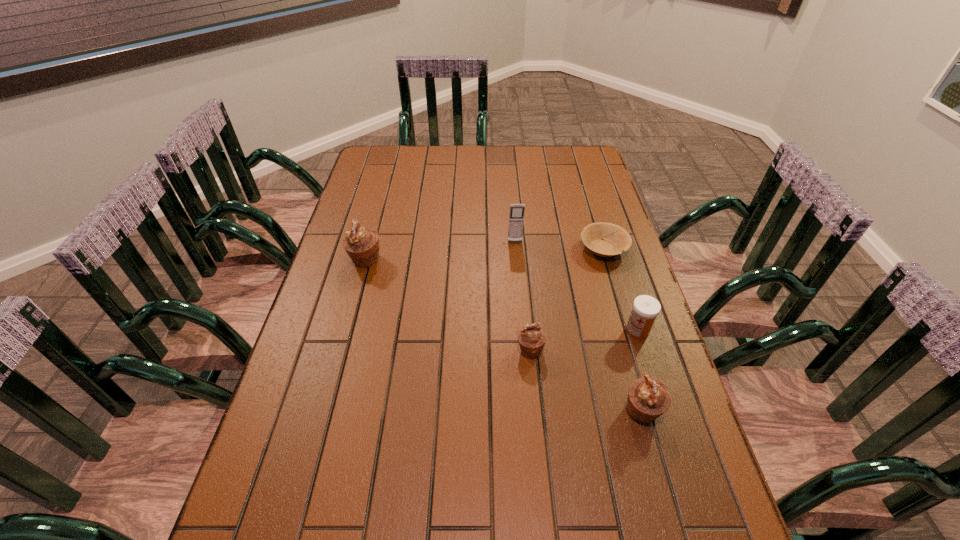
The image size is (960, 540). In order to click on the tallest muffin in this screenshot , I will do `click(362, 245)`.

The width and height of the screenshot is (960, 540). In order to click on the farthest muffin in this screenshot , I will do `click(362, 245)`.

Where is `the second farthest muffin`? This screenshot has width=960, height=540. the second farthest muffin is located at coordinates (531, 338).

At what (x,y) coordinates should I click in order to perform the action: click on the shortest muffin. Please return your answer as a coordinate pair (x, y). The height and width of the screenshot is (540, 960). Looking at the image, I should click on (531, 338).

Locate an element on the screen. The height and width of the screenshot is (540, 960). the nearest muffin is located at coordinates (648, 398).

The image size is (960, 540). In order to click on the rightmost muffin in this screenshot , I will do `click(648, 398)`.

Find the location of a particular element. This screenshot has height=540, width=960. bowl is located at coordinates (616, 240).

Where is `medicine`? The image size is (960, 540). medicine is located at coordinates (646, 308).

Image resolution: width=960 pixels, height=540 pixels. I want to click on cellular telephone, so click(x=516, y=217).

Where is `vacant space situated on the right of the leftmost muffin`? Image resolution: width=960 pixels, height=540 pixels. vacant space situated on the right of the leftmost muffin is located at coordinates (399, 260).